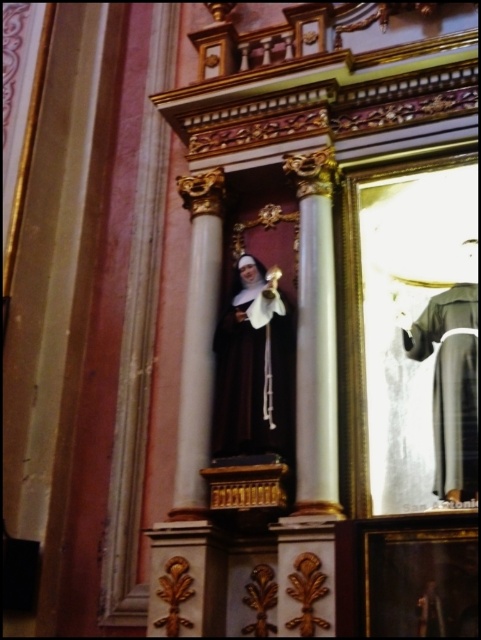
You are an interior designer assessing the space for a new lighting fixture. You notice the matte black statue at center and the gray matte robe at right. Which object should you consider in terms of scale when planning the placement of a large chandelier above them?

The matte black statue at center is larger in size than the gray matte robe at right, so you should consider the scale relative to the statue when planning the placement of the chandelier to ensure proper proportion and balance.

You are an interior designer assessing the placement of items in the church. You need to ensure that the matte black statue at center and the gray matte robe at right are positioned correctly according to the design plan. Based on their current positions, which object is higher up in the image?

The matte black statue at center is located above the gray matte robe at right, so it is higher up in the image.